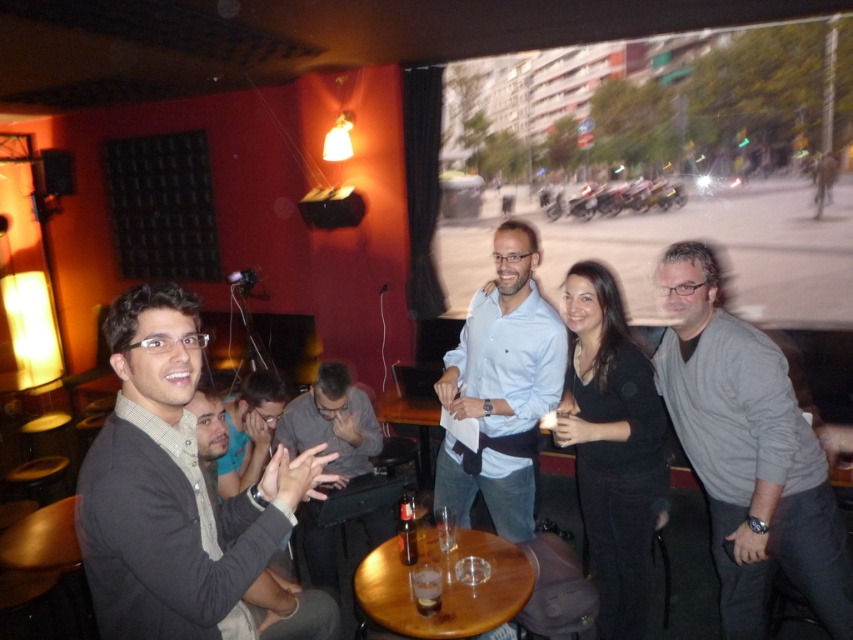
Question: Does gray sweater at center have a greater width compared to translucent glass at table center?

Choices:
 (A) yes
 (B) no

Answer: (A)

Question: Does light blue shirt at center appear over wooden table at center?

Choices:
 (A) no
 (B) yes

Answer: (B)

Question: Estimate the real-world distances between objects in this image. Which object is farther from the light blue shirt at center?

Choices:
 (A) wooden table at center
 (B) translucent glass at table center
 (C) gray fabric shirt at center

Answer: (B)

Question: Which point is closer to the camera?

Choices:
 (A) [436, 609]
 (B) [318, 552]
 (C) [401, 552]
 (D) [469, 400]

Answer: (A)

Question: Can you confirm if light blue shirt at center is wider than translucent glass at table center?

Choices:
 (A) yes
 (B) no

Answer: (A)

Question: Considering the real-world distances, which object is farthest from the wooden table at center?

Choices:
 (A) gray sweater at center
 (B) gray fabric shirt at center
 (C) translucent glass at table center

Answer: (A)